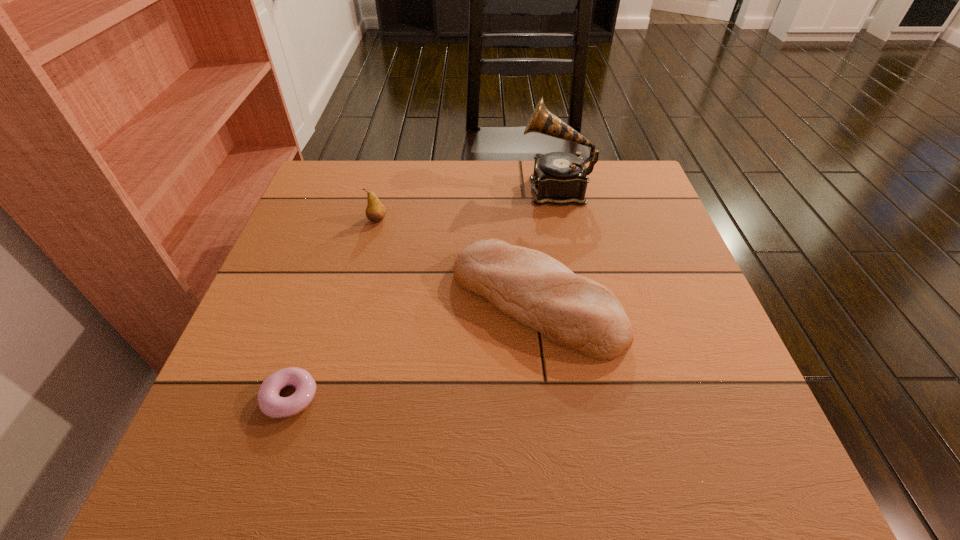
Locate an element on the screen. The width and height of the screenshot is (960, 540). object that can be found as the closest to the third nearest object is located at coordinates (572, 311).

This screenshot has width=960, height=540. In order to click on the third closest object relative to the third nearest object in this screenshot , I will do `click(270, 403)`.

You are a GUI agent. You are given a task and a screenshot of the screen. Output one action in this format:
    pyautogui.click(x=<x>, y=<y>)
    Task: Click on the vacant space that satisfies the following two spatial constraints: 1. on the horn of the phonograph record; 2. on the front side of the second nearest object
    This screenshot has height=540, width=960.
    Given the screenshot: What is the action you would take?
    pyautogui.click(x=578, y=301)

This screenshot has height=540, width=960. Find the location of `blank space that satisfies the following two spatial constraints: 1. on the front side of the third farthest object; 2. on the right side of the third nearest object`. blank space that satisfies the following two spatial constraints: 1. on the front side of the third farthest object; 2. on the right side of the third nearest object is located at coordinates (357, 301).

I want to click on free location that satisfies the following two spatial constraints: 1. on the back side of the pear; 2. on the right side of the nearest object, so click(x=348, y=220).